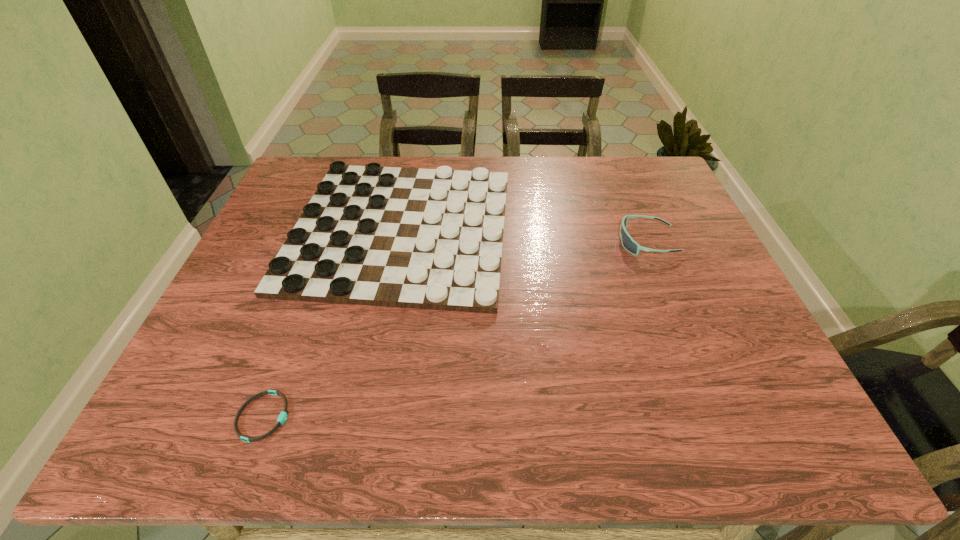
The width and height of the screenshot is (960, 540). Find the location of `free area in between the wristband and the second tallest object`. free area in between the wristband and the second tallest object is located at coordinates (332, 323).

Identify the location of free space between the gameboard and the tallest object. This screenshot has height=540, width=960. (524, 235).

Where is `vacant area between the second shortest object and the tallest object`? The image size is (960, 540). vacant area between the second shortest object and the tallest object is located at coordinates (524, 235).

Image resolution: width=960 pixels, height=540 pixels. I want to click on object that is the closest to the rightmost object, so click(x=432, y=239).

I want to click on object that is the second closest to the nearest object, so click(629, 244).